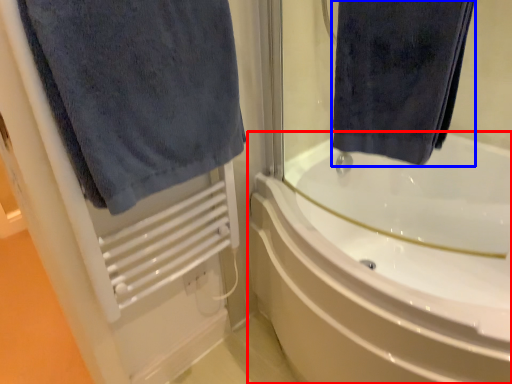
Question: Which of the following is the closest to the observer, bathtub (highlighted by a red box) or towel (highlighted by a blue box)?

Choices:
 (A) bathtub
 (B) towel

Answer: (B)